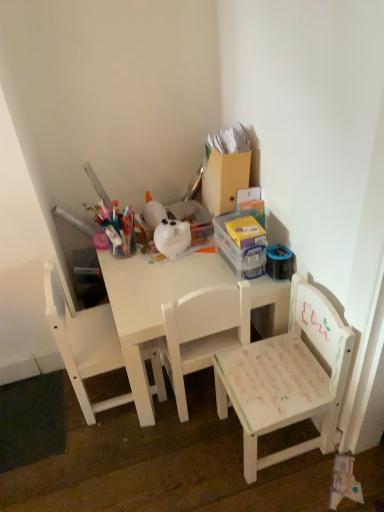
This screenshot has height=512, width=384. I want to click on unoccupied area in front of white painted wood chair at center, marked as the 2th chair in a right-to-left arrangement, so click(180, 450).